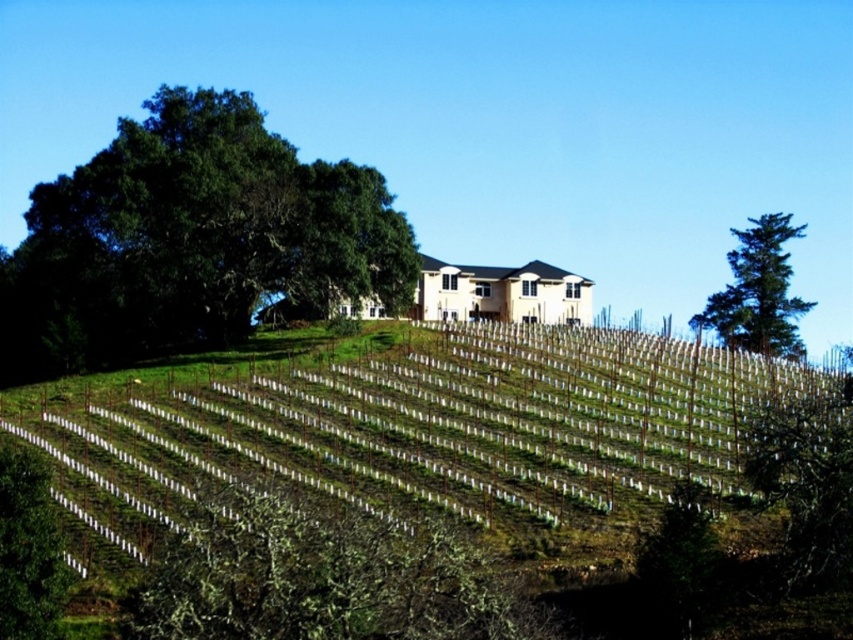
Can you confirm if green leafy tree at upper left is positioned above green textured tree at right?

Yes, green leafy tree at upper left is above green textured tree at right.

The width and height of the screenshot is (853, 640). What do you see at coordinates (192, 240) in the screenshot?
I see `green leafy tree at upper left` at bounding box center [192, 240].

Describe the element at coordinates (192, 240) in the screenshot. I see `green leafy tree at upper left` at that location.

At what (x,y) coordinates should I click in order to perform the action: click on green leafy tree at upper left. Please return your answer as a coordinate pair (x, y). The image size is (853, 640). Looking at the image, I should click on coord(192,240).